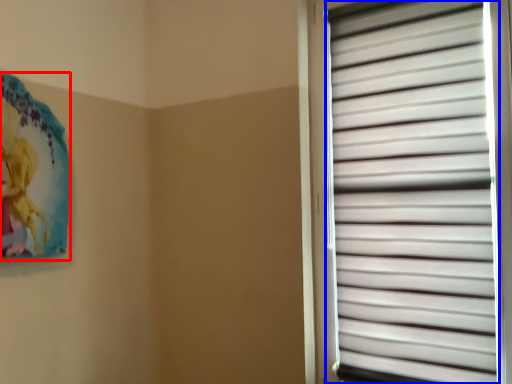
Question: Which of the following is the closest to the observer, art (highlighted by a red box) or window blind (highlighted by a blue box)?

Choices:
 (A) art
 (B) window blind

Answer: (B)